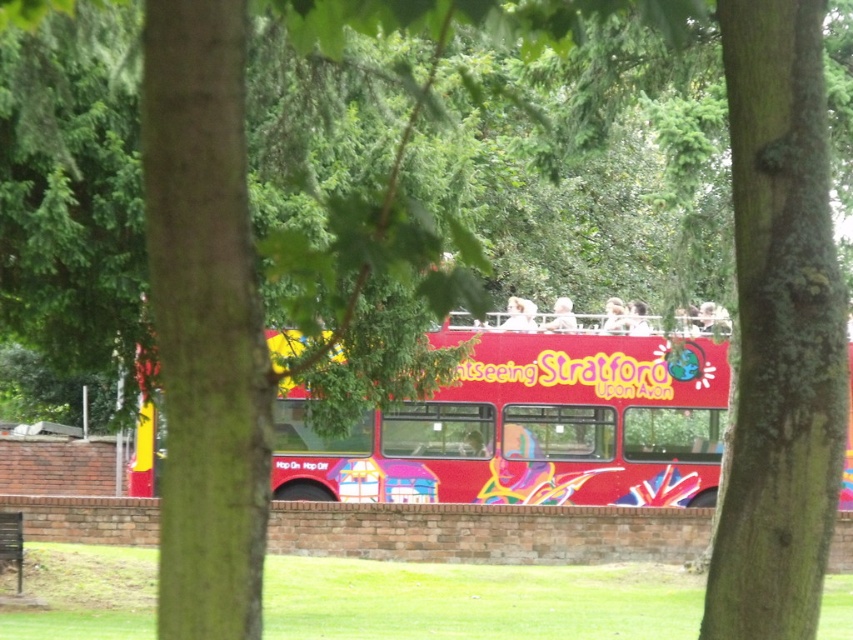
You are standing in front of the vibrant red double decker bus and want to determine the relative positions of two points marked on the bus. Which point is closer to you, point (805,332) or point (685,486)?

Point (805,332) is closer to the viewer than point (685,486).

You are a photographer trying to capture both the green rough bark tree at center and the shiny red bus at center in a single frame. Based on their positions, which object should you focus on first to ensure both are in the shot?

The green rough bark tree at center is located above the shiny red bus at center, so you should focus on the shiny red bus at center first to ensure both are in the shot.

You are a tourist standing in front of the shiny red bus at center and the green rough bark tree at center. Which object is nearer to you?

The green rough bark tree at center is closer to the viewer than the shiny red bus at center.